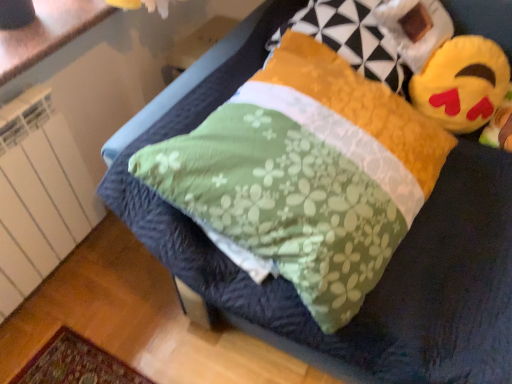
You are a GUI agent. You are given a task and a screenshot of the screen. Output one action in this format:
    pyautogui.click(x=<x>, y=<y>)
    Task: Click on the free point above yellow plush toy at upper right (from a real-world perspective)
    The image size is (512, 384).
    Given the screenshot: What is the action you would take?
    pyautogui.click(x=464, y=51)